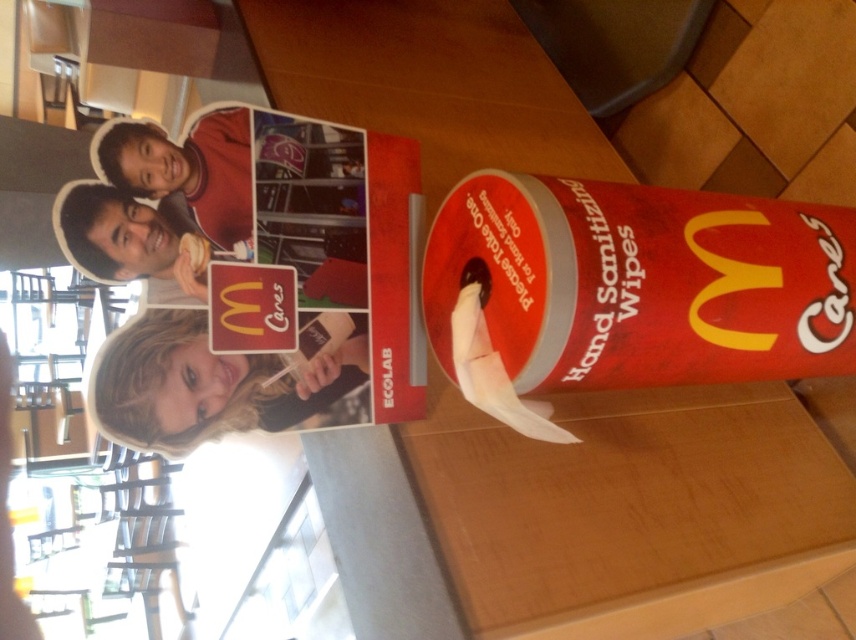
In the McDonalds promotional display scene, there is a blonde hair at upper left and a matte black headband at upper left. Which one is more to the right?

The blonde hair at upper left is positioned on the right side of matte black headband at upper left, so the blonde hair at upper left is more to the right.

You are a customer entering the McDonalds restaurant and see the blonde hair at upper left and the white paper at center. Which object is shorter?

The blonde hair at upper left is shorter than the white paper at center.

You are standing in front of the McDonald Hand Sanitizing Wipes display. There are two points marked on the display. Which point is closer to you, point (x=211, y=208) or point (x=528, y=401)?

Point (x=211, y=208) is closer to the viewer than point (x=528, y=401).